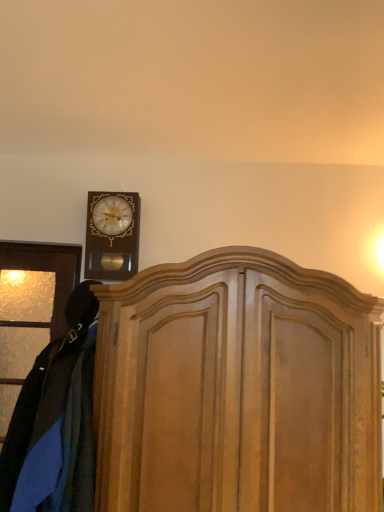
Question: From a real-world perspective, relative to wooden dresser at center, is velvet blue coat at left vertically above or below?

Choices:
 (A) above
 (B) below

Answer: (B)

Question: Looking at the image, does velvet blue coat at left seem bigger or smaller compared to wooden dresser at center?

Choices:
 (A) small
 (B) big

Answer: (A)

Question: Which object is positioned closest to the wooden dresser at center?

Choices:
 (A) wooden wall clock at upper left
 (B) velvet blue coat at left

Answer: (B)

Question: Considering the real-world distances, which object is closest to the wooden dresser at center?

Choices:
 (A) velvet blue coat at left
 (B) wooden wall clock at upper left

Answer: (A)